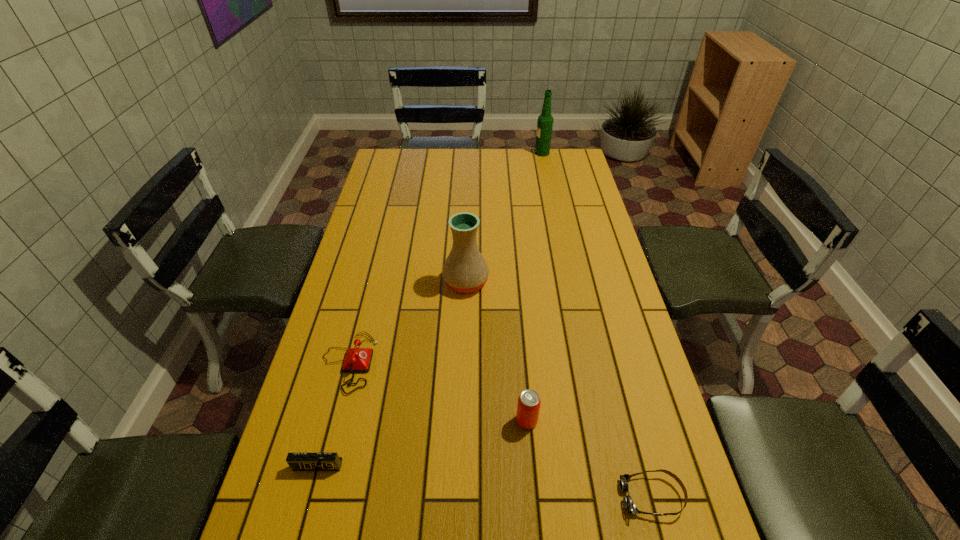
Find the location of `unoccupied position between the pottery and the third farthest object`. unoccupied position between the pottery and the third farthest object is located at coordinates (407, 322).

Locate an element on the screen. The width and height of the screenshot is (960, 540). free space that is in between the beer can and the fourth nearest object is located at coordinates (438, 392).

Locate an element on the screen. blank region between the nearest object and the alarm clock is located at coordinates (485, 481).

Find the location of `vacant point located between the second tallest object and the farthest object`. vacant point located between the second tallest object and the farthest object is located at coordinates (504, 218).

Image resolution: width=960 pixels, height=540 pixels. Find the location of `free space that is in between the fifth farthest object and the beer bottle`. free space that is in between the fifth farthest object and the beer bottle is located at coordinates click(430, 309).

I want to click on free space between the fourth farthest object and the third object from left to right, so click(x=496, y=352).

The image size is (960, 540). What are the coordinates of `vacant region between the beer bottle and the third nearest object` in the screenshot? It's located at (535, 287).

Locate an element on the screen. The image size is (960, 540). free area in between the third nearest object and the third farthest object is located at coordinates (438, 392).

Identify the location of free point between the fourth nearest object and the third nearest object. The height and width of the screenshot is (540, 960). (438, 392).

You are a GUI agent. You are given a task and a screenshot of the screen. Output one action in this format:
    pyautogui.click(x=<x>, y=<y>)
    Task: Click on the free space between the beer bottle and the goggles
    The width and height of the screenshot is (960, 540).
    Given the screenshot: What is the action you would take?
    pyautogui.click(x=597, y=325)